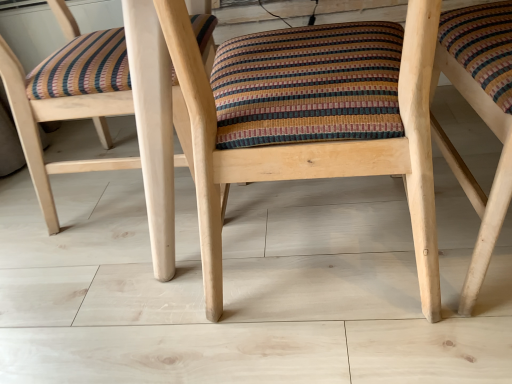
Question: Is wooden chair at center, positioned as the 3th chair in right-to-left order, to the left or to the right of natural wood chair at center, the 3th chair when ordered from left to right, in the image?

Choices:
 (A) left
 (B) right

Answer: (A)

Question: Choose the correct answer: Is wooden chair at center, marked as the first chair in a left-to-right arrangement, inside natural wood chair at center, the 1th chair viewed from the right, or outside it?

Choices:
 (A) inside
 (B) outside

Answer: (B)

Question: Estimate the real-world distances between objects in this image. Which object is closer to the wooden chair at center, positioned as the 2th chair in right-to-left order?

Choices:
 (A) natural wood chair at center, the 1th chair viewed from the right
 (B) wooden chair at center, positioned as the 3th chair in right-to-left order

Answer: (B)

Question: Considering the real-world distances, which object is farthest from the wooden chair at center, marked as the first chair in a left-to-right arrangement?

Choices:
 (A) wooden chair at center, which appears as the 2th chair when viewed from the left
 (B) natural wood chair at center, the 1th chair viewed from the right

Answer: (B)